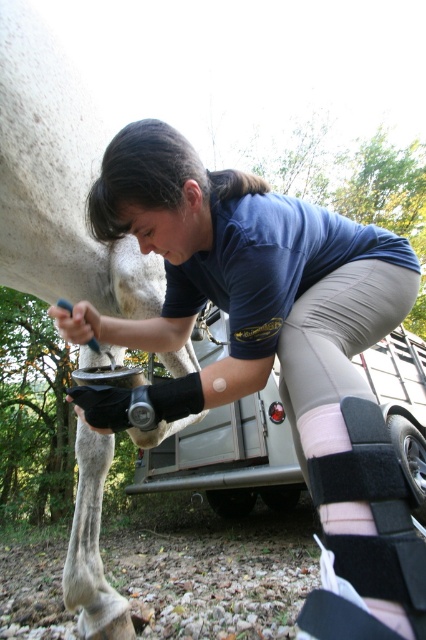
Looking at this image, is white matte horse leg at upper left positioned before black/pink fabric knee pad at lower center?

No, it is behind black/pink fabric knee pad at lower center.

Between white matte horse leg at upper left and black/pink fabric knee pad at lower center, which one has more height?

With more height is white matte horse leg at upper left.

Measure the distance between white matte horse leg at upper left and camera.

The distance of white matte horse leg at upper left from camera is 4.58 feet.

Locate an element on the screen. The image size is (426, 640). white matte horse leg at upper left is located at coordinates (57, 179).

Can you confirm if black matte knee brace at lower center is smaller than white matte horse leg at upper left?

Actually, black matte knee brace at lower center might be larger than white matte horse leg at upper left.

Which is in front, point (150, 403) or point (89, 472)?

Point (150, 403) is in front.

The image size is (426, 640). Find the location of `black matte knee brace at lower center`. black matte knee brace at lower center is located at coordinates (262, 317).

What do you see at coordinates (262, 317) in the screenshot? Image resolution: width=426 pixels, height=640 pixels. I see `black matte knee brace at lower center` at bounding box center [262, 317].

Does black matte knee brace at lower center have a larger size compared to black/pink fabric knee pad at lower center?

Yes.

Which is in front, point (296, 365) or point (321, 461)?

Point (321, 461)

In order to click on black matte knee brace at lower center in this screenshot , I will do `click(262, 317)`.